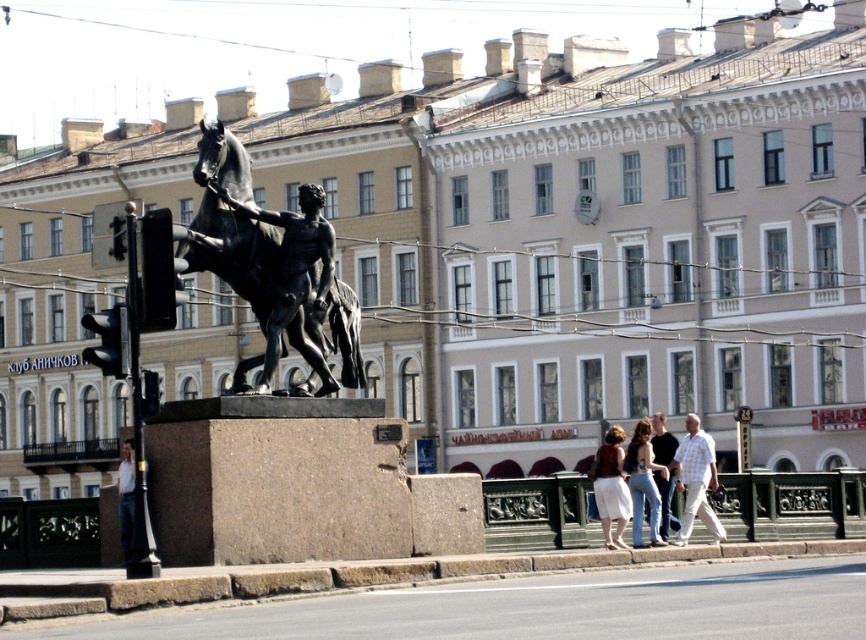
Which of these two, white checkered shirt at center or denim jeans at lower right, stands taller?

denim jeans at lower right is taller.

Between point (706, 525) and point (640, 472), which one is positioned in front?

Point (640, 472) is more forward.

Find the location of a particular element. white checkered shirt at center is located at coordinates click(x=696, y=480).

Which of these two, white cotton skirt at lower center or denim jeans at lower right, stands taller?

With more height is white cotton skirt at lower center.

Which is behind, point (612, 477) or point (637, 513)?

Positioned behind is point (637, 513).

Locate an element on the screen. This screenshot has width=866, height=640. white cotton skirt at lower center is located at coordinates (611, 486).

The width and height of the screenshot is (866, 640). What are the coordinates of `white cotton skirt at lower center` in the screenshot? It's located at (611, 486).

Does point (628, 454) come closer to viewer compared to point (662, 460)?

Yes, point (628, 454) is in front of point (662, 460).

Does denim jeans at lower right have a lesser width compared to light blue jeans at center?

Indeed, denim jeans at lower right has a lesser width compared to light blue jeans at center.

Which is behind, point (625, 458) or point (671, 444)?

Positioned behind is point (671, 444).

Locate an element on the screen. This screenshot has width=866, height=640. denim jeans at lower right is located at coordinates (643, 483).